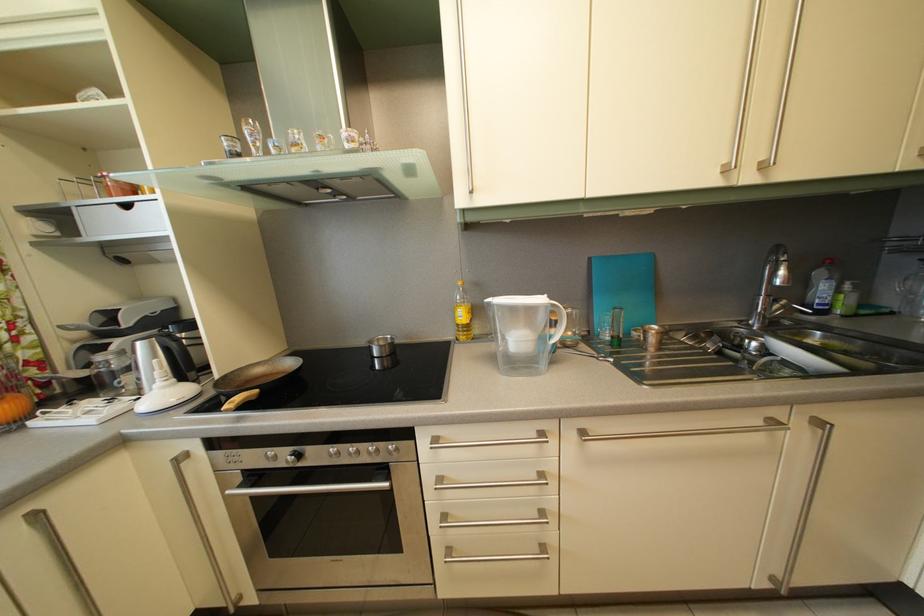
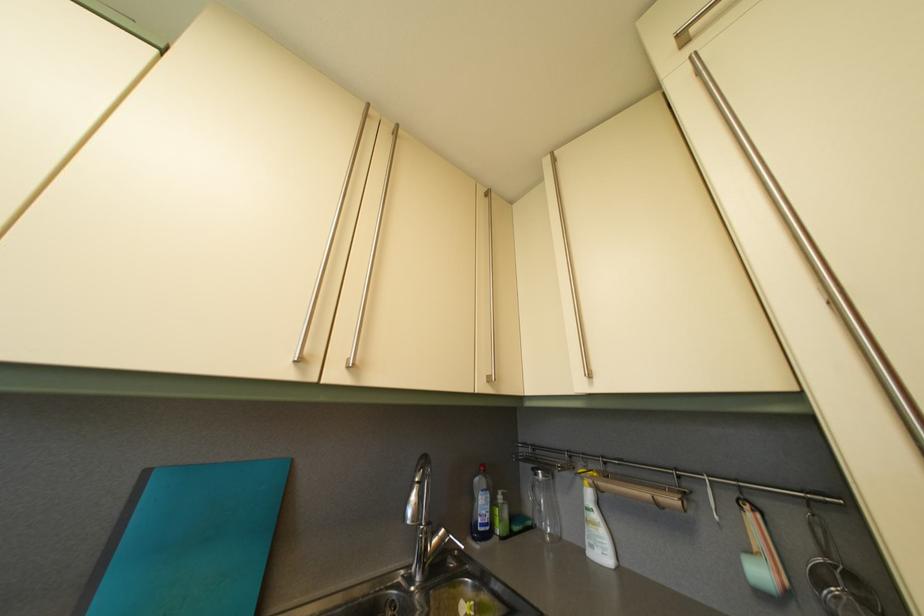
The point at (792, 309) is marked in the first image. Where is the corresponding point in the second image?

(451, 539)